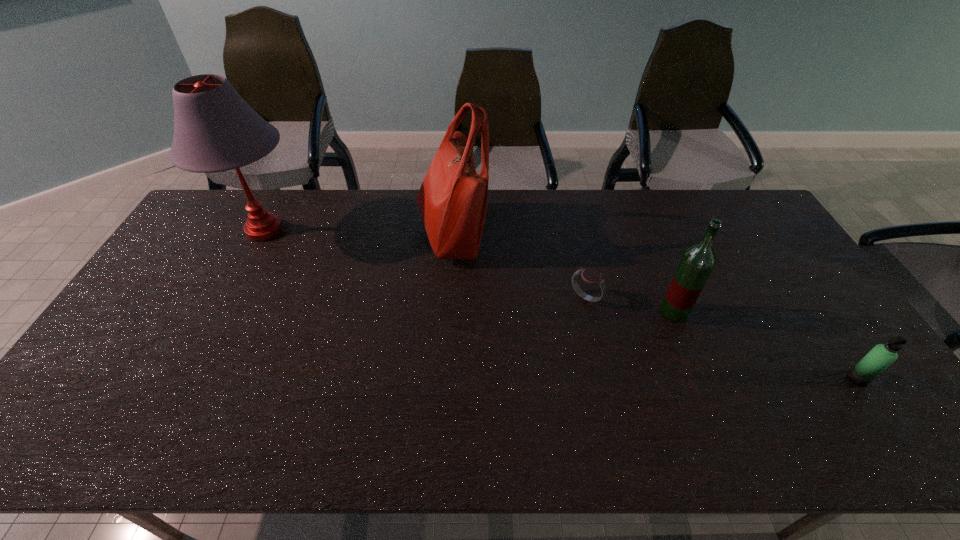
This screenshot has width=960, height=540. What are the coordinates of `vacant space positioned 0.340m on the left of the third shortest object` in the screenshot? It's located at (541, 312).

This screenshot has height=540, width=960. What are the coordinates of `free space located on the back of the second shortest object` in the screenshot? It's located at (838, 351).

This screenshot has height=540, width=960. Find the location of `free region located on the back of the watch`. free region located on the back of the watch is located at coordinates (573, 241).

You are a GUI agent. You are given a task and a screenshot of the screen. Output one action in this format:
    pyautogui.click(x=<x>, y=<y>)
    Task: Click on the table lamp at the far edge
    
    Given the screenshot: What is the action you would take?
    pyautogui.click(x=215, y=129)

Locate an element on the screen. Image resolution: width=960 pixels, height=540 pixels. handbag that is at the far edge is located at coordinates (452, 200).

What are the coordinates of `object that is at the left edge` in the screenshot? It's located at tap(215, 129).

The height and width of the screenshot is (540, 960). I want to click on object that is positioned at the right edge, so click(881, 356).

Find the location of a particular element. This screenshot has width=960, height=540. object at the far left corner is located at coordinates (215, 129).

Find the location of a particular element. free space at the far edge of the desktop is located at coordinates (618, 227).

What are the coordinates of `vacant space at the near edge` in the screenshot? It's located at (434, 447).